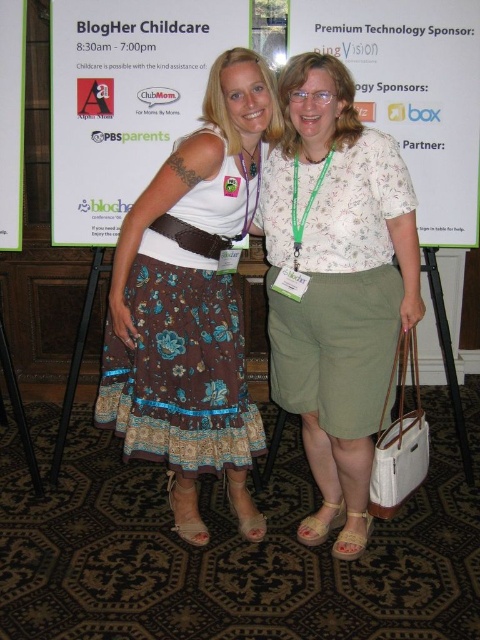
Question: Does floral cotton blouse at center have a smaller size compared to white paper at center?

Choices:
 (A) yes
 (B) no

Answer: (B)

Question: Which of the following is the farthest from the observer?

Choices:
 (A) tan leather sandal at lower center
 (B) brown floral skirt at left
 (C) brown leather belt at center
 (D) white paper at center

Answer: (D)

Question: Considering the real-world distances, which object is farthest from the brown suede sandal at lower center?

Choices:
 (A) white paper at center
 (B) matte brown sandal at lower center

Answer: (A)

Question: Can you confirm if white paper poster at upper center is positioned to the right of matte brown sandal at lower center?

Choices:
 (A) yes
 (B) no

Answer: (B)

Question: Which object appears closest to the camera in this image?

Choices:
 (A) tan leather sandal at lower center
 (B) floral cotton blouse at center

Answer: (B)

Question: Is floral cotton blouse at center closer to the viewer compared to white paper poster at upper center?

Choices:
 (A) yes
 (B) no

Answer: (A)